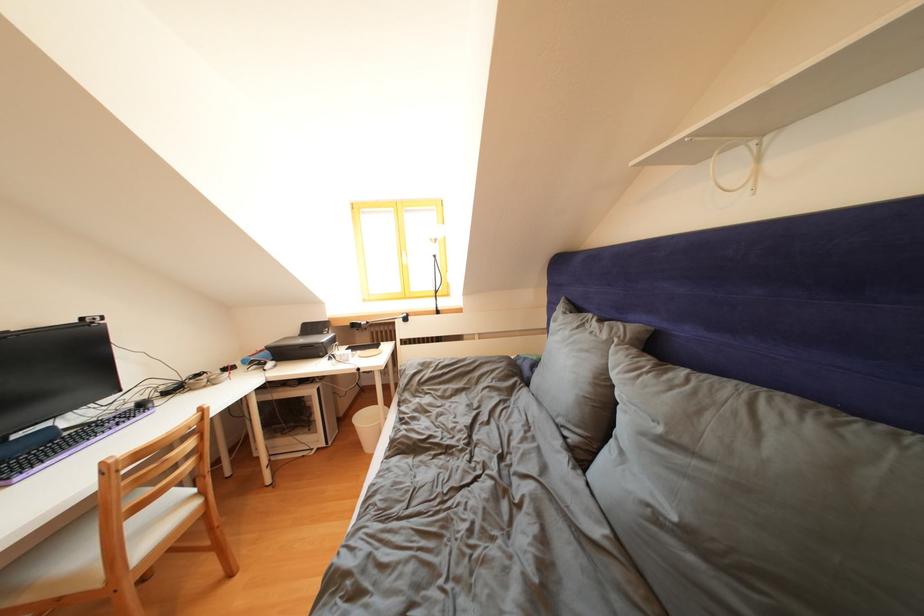
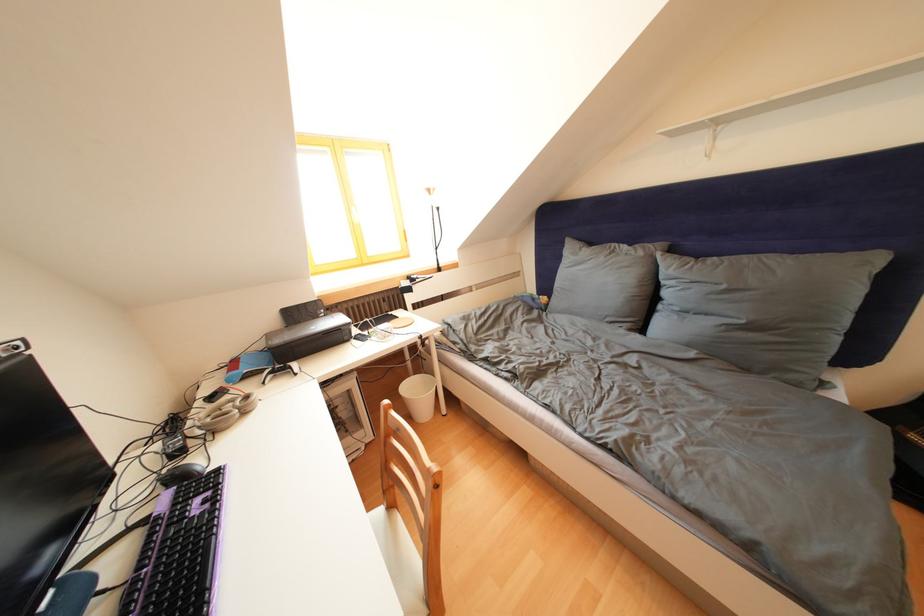
Question: I am providing you with two images of the same scene from different viewpoints. After the viewpoint changes to image2, which objects are now occluded?

Choices:
 (A) white game controller
 (B) white trash can
 (C) printer lid
 (D) none of these

Answer: (D)